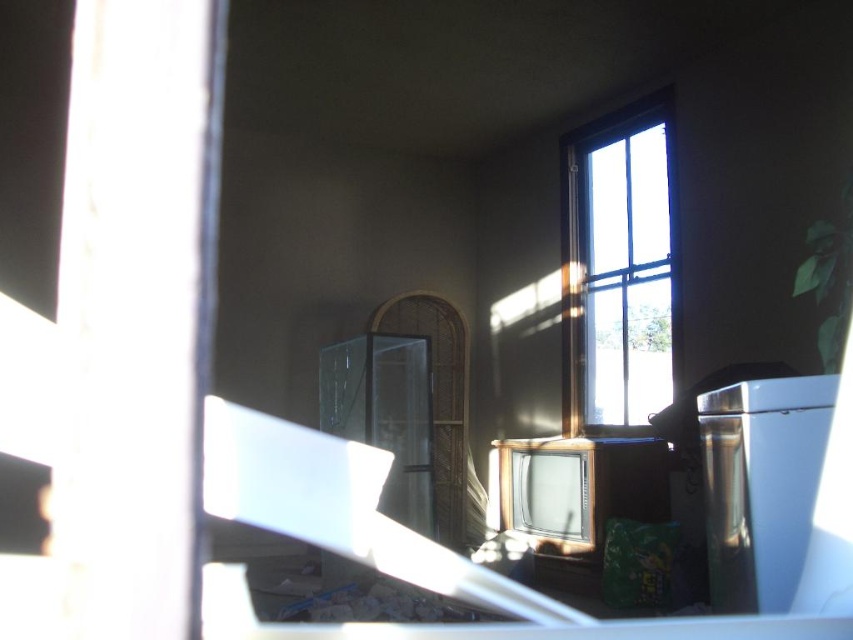
Does point (711, 586) come closer to viewer compared to point (639, 474)?

Yes.

Between point (711, 410) and point (590, 518), which one is positioned behind?

Point (590, 518)

Is point (793, 573) farther from camera compared to point (560, 554)?

That is False.

At what (x,y) coordinates should I click in order to perform the action: click on satin silver trash can at right. Please return your answer as a coordinate pair (x, y). The height and width of the screenshot is (640, 853). Looking at the image, I should click on (761, 484).

Can you confirm if clear glass window at upper right is bigger than metallic silver television at center?

Indeed, clear glass window at upper right has a larger size compared to metallic silver television at center.

Does point (636, 400) come in front of point (519, 442)?

No, (636, 400) is behind (519, 442).

At what (x,y) coordinates should I click in order to perform the action: click on clear glass window at upper right. Please return your answer as a coordinate pair (x, y). The height and width of the screenshot is (640, 853). Looking at the image, I should click on (618, 268).

Find the location of a particular element. clear glass window at upper right is located at coordinates 618,268.

How far apart are clear glass window at upper right and satin silver trash can at right?

clear glass window at upper right is 8.66 feet from satin silver trash can at right.

Is point (572, 164) behind point (724, 547)?

That is True.

Where is `clear glass window at upper right`? The width and height of the screenshot is (853, 640). clear glass window at upper right is located at coordinates (618, 268).